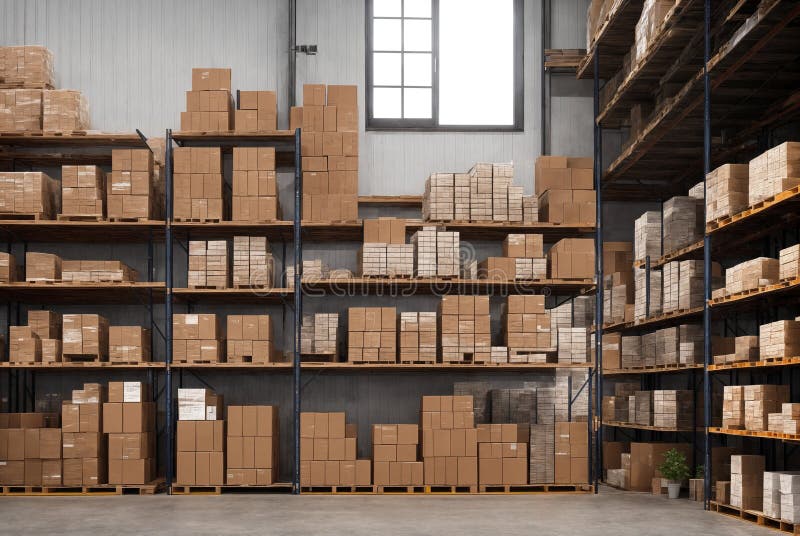
The height and width of the screenshot is (536, 800). Find the location of `window panes`. window panes is located at coordinates (396, 4), (412, 5), (401, 29), (418, 35), (388, 65), (414, 70), (396, 98), (418, 98), (498, 87).